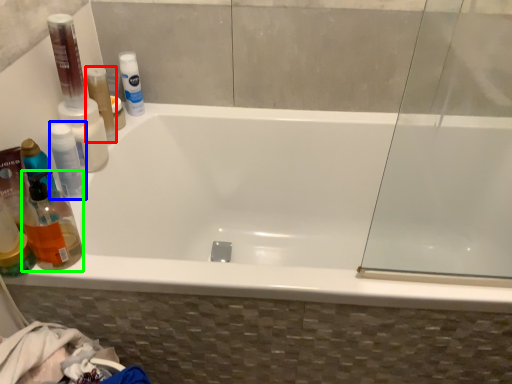
Question: Based on their relative distances, which object is nearer to mouthwash (highlighted by a red box)? Choose from mouthwash (highlighted by a blue box) and cleaning product (highlighted by a green box).

Choices:
 (A) mouthwash
 (B) cleaning product

Answer: (A)